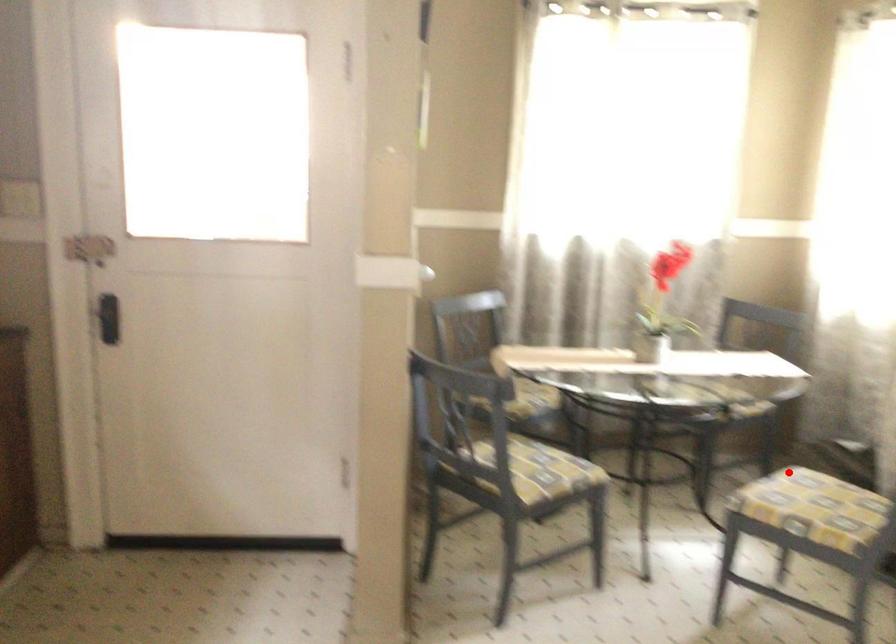
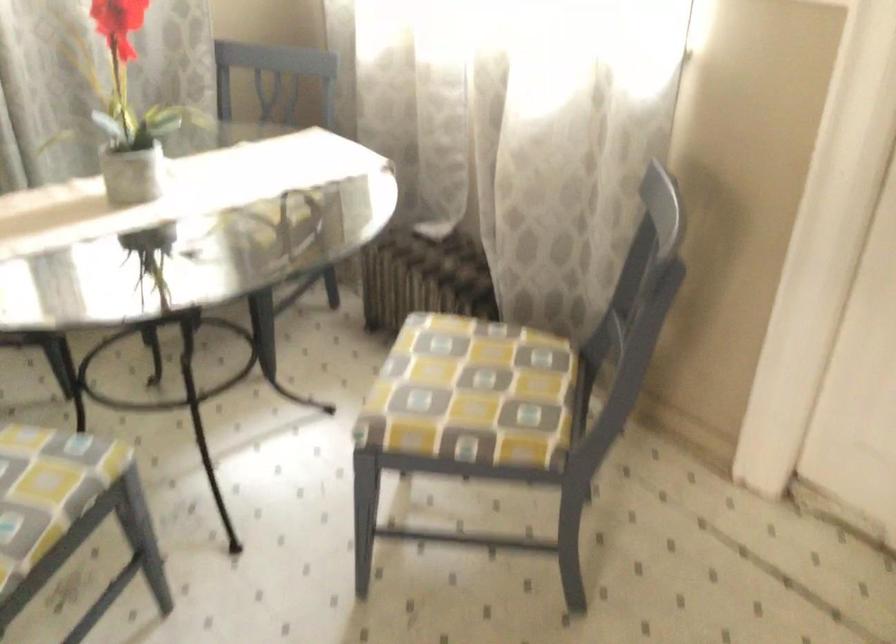
Where in the second image is the point corresponding to the highlighted location from the first image?

(467, 379)